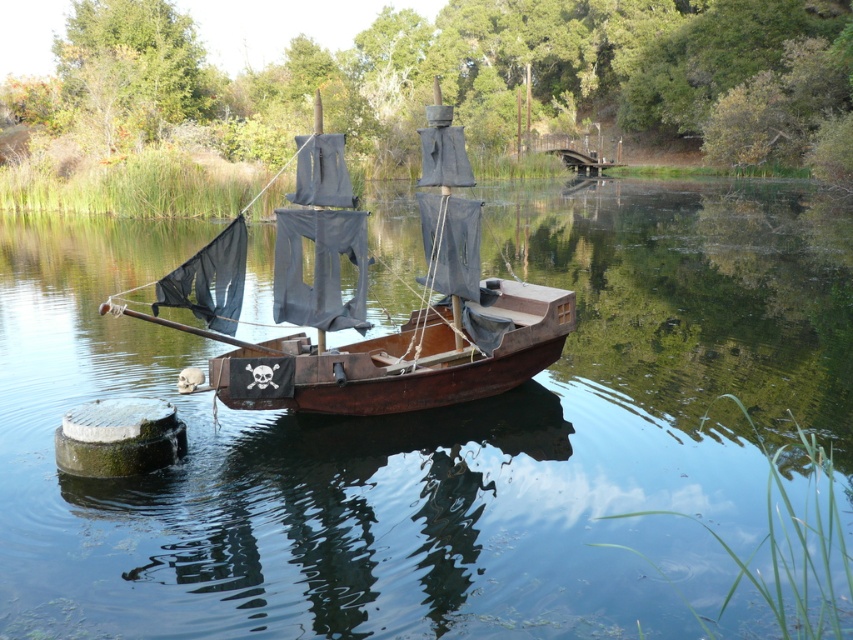
You are standing on the deck of the rusty wood sailboat at center and want to observe the reflection of the ship in the transparent water at center. Which object appears taller in the reflection?

The transparent water at center is taller than the rusty wood sailboat at center, so in the reflection, the transparent water at center will appear taller than the rusty wood sailboat at center.

You are a sailor standing on the deck of the ship. You notice the transparent water at center and the rusty wood sailboat at center. Which one appears bigger from your vantage point?

The transparent water at center is larger in size than the rusty wood sailboat at center, so the transparent water at center appears bigger from your vantage point.